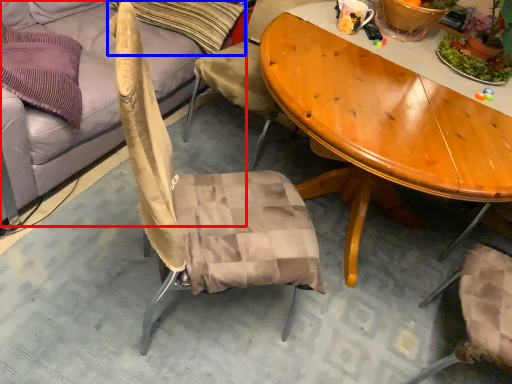
Question: Which of the following is the farthest to the observer, studio couch (highlighted by a red box) or pillow (highlighted by a blue box)?

Choices:
 (A) studio couch
 (B) pillow

Answer: (B)